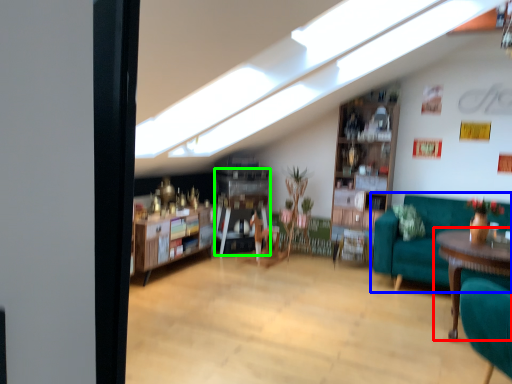
Question: Which object is the farthest from table (highlighted by a red box)? Choose among these: studio couch (highlighted by a blue box) or shelf (highlighted by a green box).

Choices:
 (A) studio couch
 (B) shelf

Answer: (B)